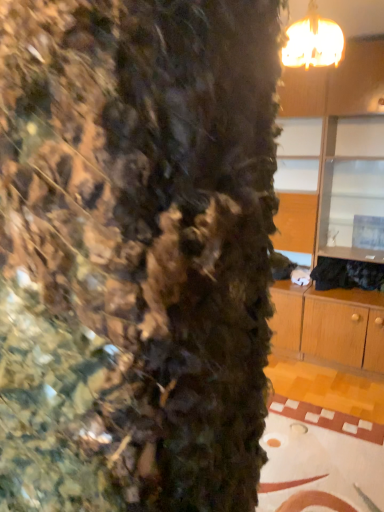
Question: From the image's perspective, is matte gold chandelier at upper right under wooden cabinet at upper right?

Choices:
 (A) no
 (B) yes

Answer: (A)

Question: Is matte gold chandelier at upper right shorter than wooden cabinet at upper right?

Choices:
 (A) no
 (B) yes

Answer: (B)

Question: Would you say matte gold chandelier at upper right is a long distance from wooden cabinet at upper right?

Choices:
 (A) no
 (B) yes

Answer: (B)

Question: Can wooden cabinet at upper right be found inside matte gold chandelier at upper right?

Choices:
 (A) yes
 (B) no

Answer: (B)

Question: Considering the relative sizes of matte gold chandelier at upper right and wooden cabinet at upper right in the image provided, is matte gold chandelier at upper right thinner than wooden cabinet at upper right?

Choices:
 (A) yes
 (B) no

Answer: (A)

Question: From a real-world perspective, is matte gold chandelier at upper right located beneath wooden cabinet at upper right?

Choices:
 (A) yes
 (B) no

Answer: (B)

Question: Can you confirm if wooden cabinet at upper right is smaller than matte gold chandelier at upper right?

Choices:
 (A) yes
 (B) no

Answer: (B)

Question: From a real-world perspective, is wooden cabinet at upper right on top of matte gold chandelier at upper right?

Choices:
 (A) no
 (B) yes

Answer: (A)

Question: Does wooden cabinet at upper right have a lesser height compared to matte gold chandelier at upper right?

Choices:
 (A) yes
 (B) no

Answer: (B)

Question: Is wooden cabinet at upper right looking in the opposite direction of matte gold chandelier at upper right?

Choices:
 (A) no
 (B) yes

Answer: (A)

Question: Is wooden cabinet at upper right not within matte gold chandelier at upper right?

Choices:
 (A) no
 (B) yes

Answer: (B)

Question: Is the position of wooden cabinet at upper right more distant than that of matte gold chandelier at upper right?

Choices:
 (A) no
 (B) yes

Answer: (B)

Question: Is matte gold chandelier at upper right wider or thinner than wooden cabinet at upper right?

Choices:
 (A) wide
 (B) thin

Answer: (B)